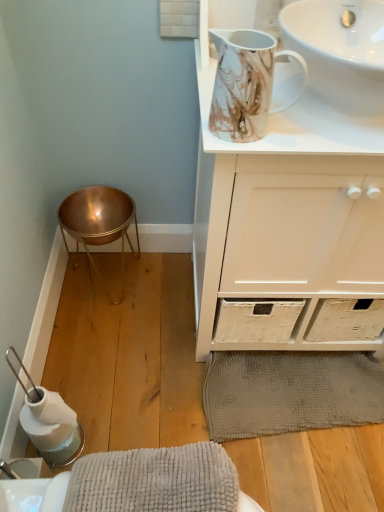
Image resolution: width=384 pixels, height=512 pixels. I want to click on copper/metallic bar stool at lower left, so click(99, 222).

What do you see at coordinates (318, 125) in the screenshot? The width and height of the screenshot is (384, 512). I see `white glossy sink at upper right, placed as the 1th sink when sorted from bottom to top` at bounding box center [318, 125].

Describe the element at coordinates (340, 51) in the screenshot. Image resolution: width=384 pixels, height=512 pixels. I see `white glossy sink at upper right, the first sink positioned from the top` at that location.

Describe the element at coordinates (290, 392) in the screenshot. The width and height of the screenshot is (384, 512). I see `gray textured bath mat at lower center` at that location.

Where is `white matte cabinet at upper center`? This screenshot has height=512, width=384. white matte cabinet at upper center is located at coordinates (299, 187).

Is copper/metallic bar stool at lower left not near gray textured bath mat at lower center?

No, copper/metallic bar stool at lower left is not far away from gray textured bath mat at lower center.

In the image, is copper/metallic bar stool at lower left positioned in front of or behind gray textured bath mat at lower center?

copper/metallic bar stool at lower left is behind gray textured bath mat at lower center.

Can you confirm if copper/metallic bar stool at lower left is positioned to the right of gray textured bath mat at lower center?

In fact, copper/metallic bar stool at lower left is to the left of gray textured bath mat at lower center.

Between white matte cabinet at upper center and copper/metallic bar stool at lower left, which one has less height?

copper/metallic bar stool at lower left.

Considering the points (317, 11) and (107, 198), which point is behind, point (317, 11) or point (107, 198)?

The point (107, 198) is more distant.

This screenshot has height=512, width=384. What are the coordinates of `bar stool on the left of white matte cabinet at upper center` in the screenshot? It's located at (99, 222).

In terms of width, does white matte cabinet at upper center look wider or thinner when compared to copper/metallic bar stool at lower left?

white matte cabinet at upper center is wider than copper/metallic bar stool at lower left.

Identify the location of bath mat that appears below the white glossy sink at upper right, placed as the 1th sink when sorted from bottom to top (from the image's perspective). (x=290, y=392).

From the image's perspective, which is below, gray textured bath mat at lower center or white glossy sink at upper right, placed as the second sink when sorted from top to bottom?

gray textured bath mat at lower center is shown below in the image.

Considering the relative sizes of gray textured bath mat at lower center and white glossy sink at upper right, placed as the 1th sink when sorted from bottom to top, in the image provided, is gray textured bath mat at lower center thinner than white glossy sink at upper right, placed as the 1th sink when sorted from bottom to top,?

Yes, gray textured bath mat at lower center is thinner than white glossy sink at upper right, placed as the 1th sink when sorted from bottom to top.

Is gray textured bath mat at lower center looking in the opposite direction of white glossy sink at upper right, placed as the second sink when sorted from top to bottom?

gray textured bath mat at lower center does not have its back to white glossy sink at upper right, placed as the second sink when sorted from top to bottom.

Find the location of a particular element. sink lying on the left of gray textured bath mat at lower center is located at coordinates (318, 125).

Which of these two, white glossy sink at upper right, placed as the second sink when sorted from top to bottom, or gray textured bath mat at lower center, is wider?

Wider between the two is white glossy sink at upper right, placed as the second sink when sorted from top to bottom.

Is white glossy sink at upper right, placed as the second sink when sorted from top to bottom, taller than gray textured bath mat at lower center?

Yes, white glossy sink at upper right, placed as the second sink when sorted from top to bottom, is taller than gray textured bath mat at lower center.

Which is more to the left, gray textured bath mat at lower center or white matte cabinet at upper center?

gray textured bath mat at lower center is more to the left.

Does gray textured bath mat at lower center have a greater width compared to white matte cabinet at upper center?

No.

How different are the orientations of gray textured bath mat at lower center and white matte cabinet at upper center in degrees?

The facing directions of gray textured bath mat at lower center and white matte cabinet at upper center are 3.66 degrees apart.

Is gray textured bath mat at lower center far from white matte cabinet at upper center?

They are positioned close to each other.

Who is shorter, white glossy sink at upper right, the first sink positioned from the top, or white matte cabinet at upper center?

Standing shorter between the two is white glossy sink at upper right, the first sink positioned from the top.

Is white glossy sink at upper right, the first sink positioned from the top, thinner than white matte cabinet at upper center?

Yes, white glossy sink at upper right, the first sink positioned from the top, is thinner than white matte cabinet at upper center.

Is white glossy sink at upper right, the first sink positioned from the top, looking in the opposite direction of white matte cabinet at upper center?

white glossy sink at upper right, the first sink positioned from the top, does not have its back to white matte cabinet at upper center.

From the image's perspective, is white glossy sink at upper right, which appears as the 2th sink when ordered from the bottom, beneath white matte cabinet at upper center?

Actually, white glossy sink at upper right, which appears as the 2th sink when ordered from the bottom, appears above white matte cabinet at upper center in the image.

From the picture: Does white matte cabinet at upper center turn towards gray textured bath mat at lower center?

Yes, white matte cabinet at upper center is turned towards gray textured bath mat at lower center.

Who is shorter, white matte cabinet at upper center or gray textured bath mat at lower center?

gray textured bath mat at lower center is shorter.

Identify the location of bar stool behind the gray textured bath mat at lower center. (99, 222).

This screenshot has height=512, width=384. What are the coordinates of `bar stool located on the left of white matte cabinet at upper center` in the screenshot? It's located at (99, 222).

Looking at the image, which one is located further to copper/metallic bar stool at lower left, white matte cabinet at upper center or white glossy sink at upper right, which appears as the 2th sink when ordered from the bottom?

Based on the image, white glossy sink at upper right, which appears as the 2th sink when ordered from the bottom, appears to be further to copper/metallic bar stool at lower left.

When comparing their distances from white matte cabinet at upper center, does white glossy sink at upper right, which appears as the 2th sink when ordered from the bottom, or copper/metallic bar stool at lower left seem closer?

The object closer to white matte cabinet at upper center is white glossy sink at upper right, which appears as the 2th sink when ordered from the bottom.

Which object lies further to the anchor point gray textured bath mat at lower center, white glossy sink at upper right, the first sink positioned from the top, or white glossy sink at upper right, placed as the second sink when sorted from top to bottom?

white glossy sink at upper right, the first sink positioned from the top, is further to gray textured bath mat at lower center.

From the image, which object appears to be farther from white matte cabinet at upper center, white glossy sink at upper right, placed as the second sink when sorted from top to bottom, or white glossy sink at upper right, the first sink positioned from the top?

white glossy sink at upper right, the first sink positioned from the top, lies further to white matte cabinet at upper center than the other object.

Which object lies further to the anchor point white matte cabinet at upper center, gray textured bath mat at lower center or white glossy sink at upper right, placed as the 1th sink when sorted from bottom to top?

gray textured bath mat at lower center.

When comparing their distances from white glossy sink at upper right, the first sink positioned from the top, does white glossy sink at upper right, placed as the second sink when sorted from top to bottom, or white matte cabinet at upper center seem further?

white matte cabinet at upper center is further to white glossy sink at upper right, the first sink positioned from the top.

From the image, which object appears to be nearer to white glossy sink at upper right, placed as the second sink when sorted from top to bottom, gray textured bath mat at lower center or copper/metallic bar stool at lower left?

copper/metallic bar stool at lower left lies closer to white glossy sink at upper right, placed as the second sink when sorted from top to bottom, than the other object.

From the image, which object appears to be farther from gray textured bath mat at lower center, white glossy sink at upper right, which appears as the 2th sink when ordered from the bottom, or white matte cabinet at upper center?

The object further to gray textured bath mat at lower center is white glossy sink at upper right, which appears as the 2th sink when ordered from the bottom.

The width and height of the screenshot is (384, 512). What are the coordinates of `bar stool that lies between white glossy sink at upper right, which appears as the 2th sink when ordered from the bottom, and gray textured bath mat at lower center from top to bottom` in the screenshot? It's located at (99, 222).

The width and height of the screenshot is (384, 512). What are the coordinates of `bathroom cabinet situated between copper/metallic bar stool at lower left and white glossy sink at upper right, which appears as the 2th sink when ordered from the bottom, from left to right` in the screenshot? It's located at (299, 187).

Where is `bathroom cabinet that lies between white glossy sink at upper right, the first sink positioned from the top, and gray textured bath mat at lower center from top to bottom`? The height and width of the screenshot is (512, 384). bathroom cabinet that lies between white glossy sink at upper right, the first sink positioned from the top, and gray textured bath mat at lower center from top to bottom is located at coordinates (299, 187).

Find the location of a particular element. This screenshot has width=384, height=512. sink situated between copper/metallic bar stool at lower left and white glossy sink at upper right, the first sink positioned from the top, from left to right is located at coordinates click(318, 125).